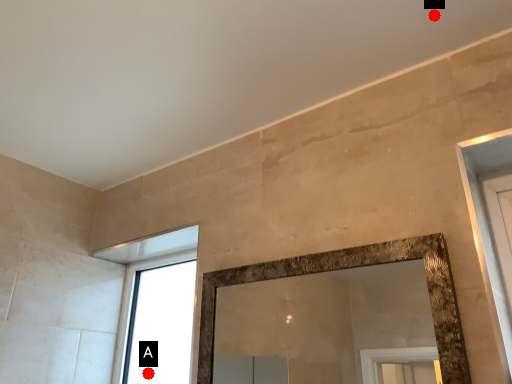
Question: Two points are circled on the image, labeled by A and B beside each circle. Which point is closer to the camera?

Choices:
 (A) A is closer
 (B) B is closer

Answer: (B)